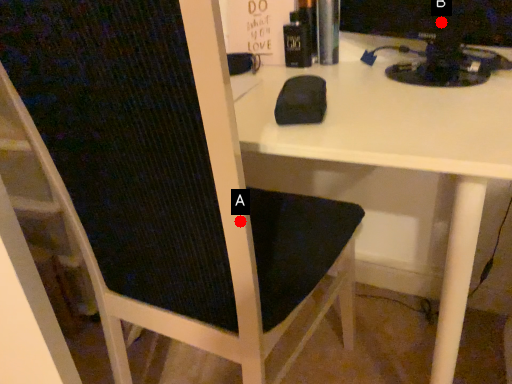
Question: Two points are circled on the image, labeled by A and B beside each circle. Which point is further to the camera?

Choices:
 (A) A is further
 (B) B is further

Answer: (B)